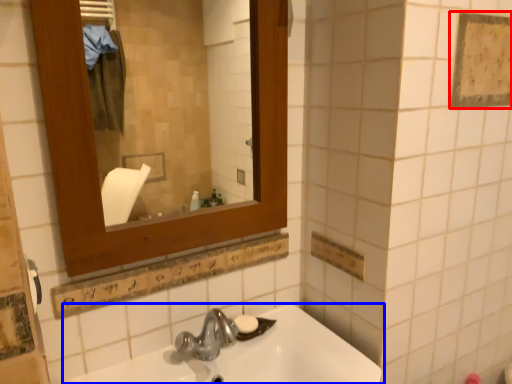
Question: Which object appears farthest to the camera in this image, square (highlighted by a red box) or sink (highlighted by a blue box)?

Choices:
 (A) square
 (B) sink

Answer: (A)